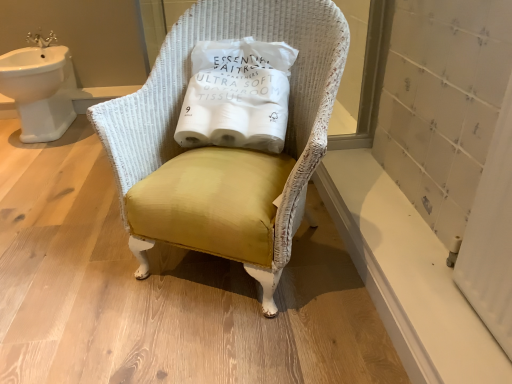
Find the location of `white ceramic sink at upper left`. white ceramic sink at upper left is located at coordinates (39, 88).

Measure the distance between point (350, 169) and camera.

Point (350, 169) and camera are 5.13 feet apart.

Locate an element on the screen. white paper toilet paper at center is located at coordinates (237, 95).

What do you see at coordinates (237, 95) in the screenshot?
I see `white paper toilet paper at center` at bounding box center [237, 95].

Describe the element at coordinates (248, 154) in the screenshot. I see `mustard velvet chair at center` at that location.

This screenshot has width=512, height=384. Find the location of `white ceramic sink at upper left`. white ceramic sink at upper left is located at coordinates tap(39, 88).

From a real-world perspective, does white smooth window sill at lower right sit lower than white ceramic sink at upper left?

Correct, in the physical world, white smooth window sill at lower right is lower than white ceramic sink at upper left.

Which object is wider, white smooth window sill at lower right or white ceramic sink at upper left?

white ceramic sink at upper left is wider.

Find the location of a particular element. The image size is (512, 384). sink that appears on the left of white smooth window sill at lower right is located at coordinates (39, 88).

Based on the photo, is white smooth window sill at lower right not near white ceramic sink at upper left?

Absolutely, white smooth window sill at lower right is distant from white ceramic sink at upper left.

Considering the positions of objects white paper toilet paper at center and mustard velvet chair at center in the image provided, who is more to the right, white paper toilet paper at center or mustard velvet chair at center?

white paper toilet paper at center.

Measure the distance between white paper toilet paper at center and mustard velvet chair at center.

A distance of 13.34 centimeters exists between white paper toilet paper at center and mustard velvet chair at center.

Is white paper toilet paper at center spatially inside mustard velvet chair at center, or outside of it?

The correct answer is: inside.

Does point (181, 118) come behind point (318, 52)?

Yes.

Between white paper toilet paper at center and white ceramic sink at upper left, which one has smaller width?

With smaller width is white paper toilet paper at center.

From a real-world perspective, is white paper toilet paper at center on white ceramic sink at upper left?

Indeed, from a real-world perspective, white paper toilet paper at center stands above white ceramic sink at upper left.

Is white paper toilet paper at center located outside white ceramic sink at upper left?

Yes.

From the image's perspective, is white paper toilet paper at center positioned above or below white ceramic sink at upper left?

From the image's perspective, white paper toilet paper at center appears below white ceramic sink at upper left.

Can you confirm if white ceramic sink at upper left is positioned to the left of white smooth window sill at lower right?

Yes.

Are white ceramic sink at upper left and white smooth window sill at lower right located far from each other?

That's right, there is a large distance between white ceramic sink at upper left and white smooth window sill at lower right.

From the image's perspective, which is below, white ceramic sink at upper left or white smooth window sill at lower right?

white smooth window sill at lower right appears lower in the image.

Does white ceramic sink at upper left have a greater height compared to white smooth window sill at lower right?

Yes.

Considering the sizes of objects mustard velvet chair at center and white ceramic sink at upper left in the image provided, who is smaller, mustard velvet chair at center or white ceramic sink at upper left?

Result: white ceramic sink at upper left is smaller.

Between mustard velvet chair at center and white ceramic sink at upper left, which one is positioned in front?

mustard velvet chair at center is more forward.

Is mustard velvet chair at center beside white ceramic sink at upper left?

No.

Considering the relative sizes of mustard velvet chair at center and white ceramic sink at upper left in the image provided, is mustard velvet chair at center shorter than white ceramic sink at upper left?

No, mustard velvet chair at center is not shorter than white ceramic sink at upper left.

Is white smooth window sill at lower right turned away from mustard velvet chair at center?

No, white smooth window sill at lower right is not facing the opposite direction of mustard velvet chair at center.

Image resolution: width=512 pixels, height=384 pixels. I want to click on window sill that is behind the mustard velvet chair at center, so click(x=407, y=275).

Can you confirm if white smooth window sill at lower right is wider than mustard velvet chair at center?

Incorrect, the width of white smooth window sill at lower right does not surpass that of mustard velvet chair at center.

How different are the orientations of white smooth window sill at lower right and mustard velvet chair at center in degrees?

62.7 degrees separate the facing orientations of white smooth window sill at lower right and mustard velvet chair at center.

How many degrees apart are the facing directions of mustard velvet chair at center and white paper toilet paper at center?

There is a 11.4-degree angle between the facing directions of mustard velvet chair at center and white paper toilet paper at center.

Does mustard velvet chair at center touch white paper toilet paper at center?

There is a gap between mustard velvet chair at center and white paper toilet paper at center.

Choose the correct answer: Is mustard velvet chair at center inside white paper toilet paper at center or outside it?

mustard velvet chair at center is not inside white paper toilet paper at center, it's outside.

I want to click on sink on the left side of white smooth window sill at lower right, so click(39, 88).

Where is `toilet paper above the mustard velvet chair at center (from the image's perspective)`? toilet paper above the mustard velvet chair at center (from the image's perspective) is located at coordinates (237, 95).

When comparing their distances from white smooth window sill at lower right, does white ceramic sink at upper left or mustard velvet chair at center seem closer?

Among the two, mustard velvet chair at center is located nearer to white smooth window sill at lower right.

Which object lies further to the anchor point mustard velvet chair at center, white smooth window sill at lower right or white paper toilet paper at center?

white smooth window sill at lower right is positioned further to the anchor mustard velvet chair at center.

Which object lies further to the anchor point white paper toilet paper at center, mustard velvet chair at center or white ceramic sink at upper left?

white ceramic sink at upper left is further to white paper toilet paper at center.

Looking at the image, which one is located further to white ceramic sink at upper left, white paper toilet paper at center or white smooth window sill at lower right?

white smooth window sill at lower right.

Considering their positions, is white smooth window sill at lower right positioned further to white paper toilet paper at center than white ceramic sink at upper left?

The object further to white paper toilet paper at center is white ceramic sink at upper left.

Based on their spatial positions, is white ceramic sink at upper left or white paper toilet paper at center further from white smooth window sill at lower right?

Based on the image, white ceramic sink at upper left appears to be further to white smooth window sill at lower right.

Which object lies further to the anchor point white smooth window sill at lower right, white paper toilet paper at center or white ceramic sink at upper left?

The object further to white smooth window sill at lower right is white ceramic sink at upper left.

When comparing their distances from mustard velvet chair at center, does white ceramic sink at upper left or white paper toilet paper at center seem further?

The object further to mustard velvet chair at center is white ceramic sink at upper left.

Find the location of `toilet paper located between white ceramic sink at upper left and white smooth window sill at lower right in the left-right direction`. toilet paper located between white ceramic sink at upper left and white smooth window sill at lower right in the left-right direction is located at coordinates (237, 95).

What are the coordinates of `toilet paper situated between mustard velvet chair at center and white smooth window sill at lower right from left to right` in the screenshot? It's located at (237, 95).

The width and height of the screenshot is (512, 384). In order to click on chair situated between white ceramic sink at upper left and white paper toilet paper at center from left to right in this screenshot , I will do `click(248, 154)`.

Find the location of `chair between white ceramic sink at upper left and white smooth window sill at lower right from left to right`. chair between white ceramic sink at upper left and white smooth window sill at lower right from left to right is located at coordinates (248, 154).